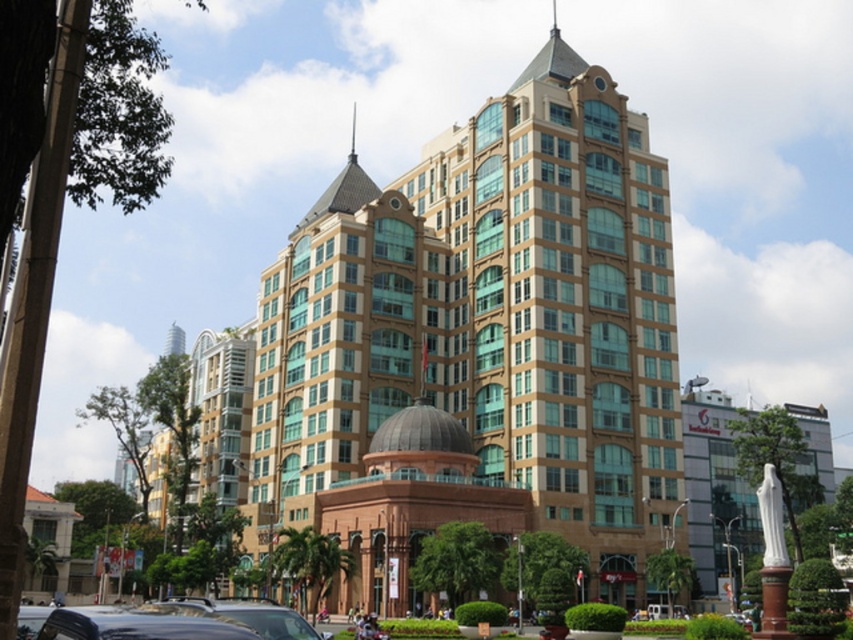
Between golden stone building at center and shiny black car at lower left, which one is positioned higher?

golden stone building at center is above.

Is golden stone building at center shorter than shiny black car at lower left?

In fact, golden stone building at center may be taller than shiny black car at lower left.

Measure the distance between golden stone building at center and camera.

60.26 meters

Where is `golden stone building at center`? The image size is (853, 640). golden stone building at center is located at coordinates (479, 336).